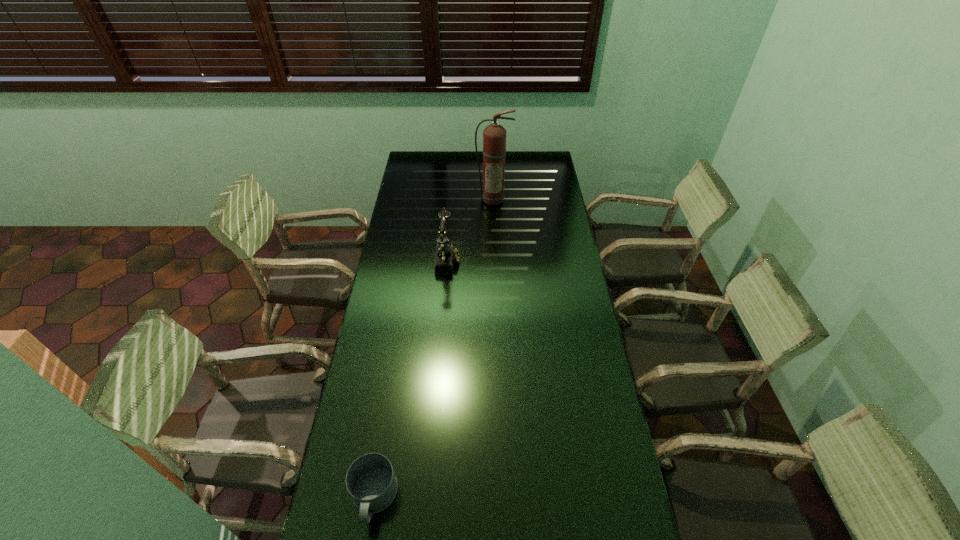
I want to click on the farthest object, so click(494, 135).

Find the location of `fire extinguisher`. fire extinguisher is located at coordinates (494, 135).

The image size is (960, 540). I want to click on the second shortest object, so click(x=446, y=254).

Locate an element on the screen. telephone is located at coordinates (446, 254).

Locate an element on the screen. the shortest object is located at coordinates (370, 480).

What are the coordinates of `the leftmost object` in the screenshot? It's located at (370, 480).

I want to click on vacant space situated 0.130m on the side of the tallest object with the label and nozzle, so click(x=493, y=223).

This screenshot has height=540, width=960. I want to click on vacant area situated on the dial of the telephone, so click(532, 259).

The image size is (960, 540). In order to click on object present at the left edge in this screenshot , I will do `click(370, 480)`.

The width and height of the screenshot is (960, 540). I want to click on vacant space at the far edge of the desktop, so click(507, 168).